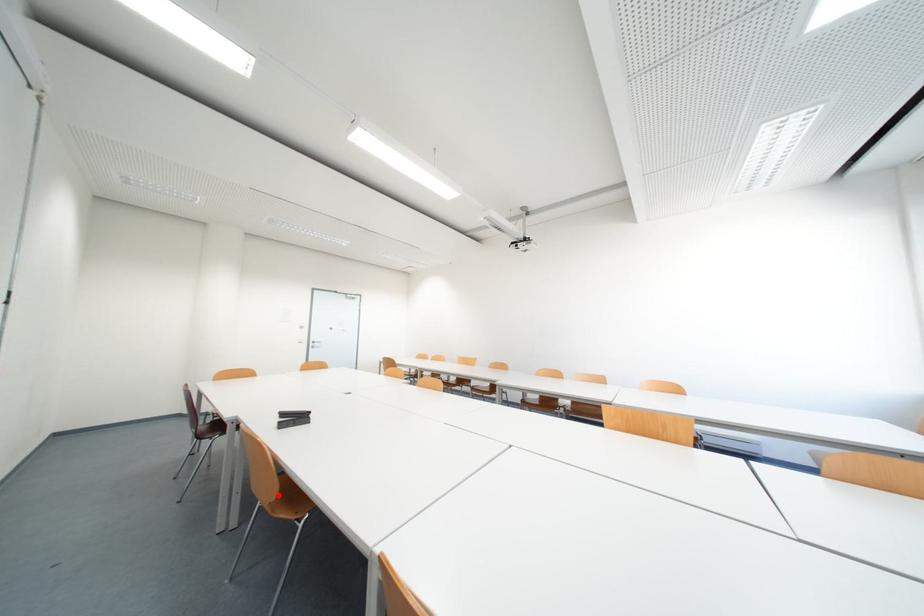
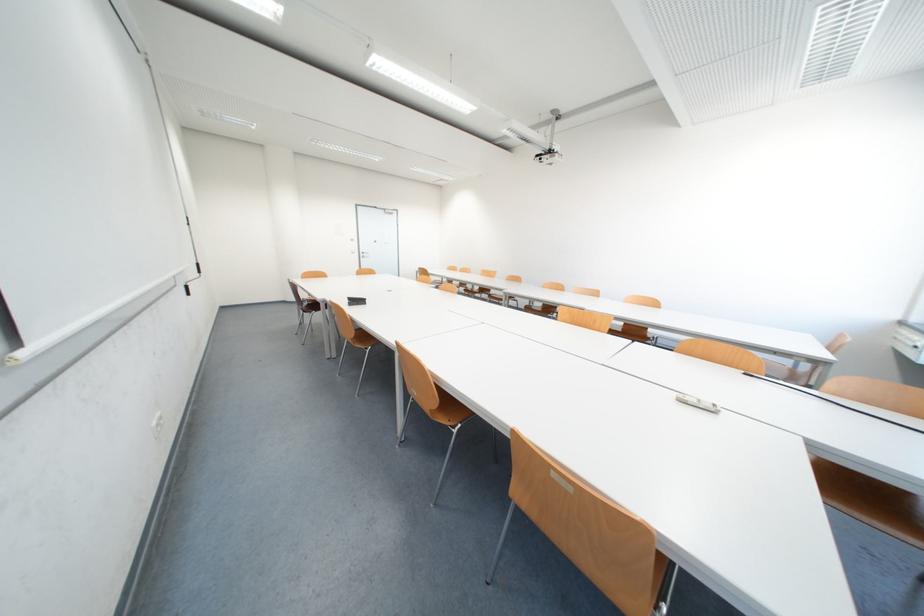
Question: I am providing you with two images of the same scene from different viewpoints. A red point is shown in image1. For the corresponding object point in image2, is it positioned nearer or farther from the camera?

Choices:
 (A) Nearer
 (B) Farther

Answer: (B)